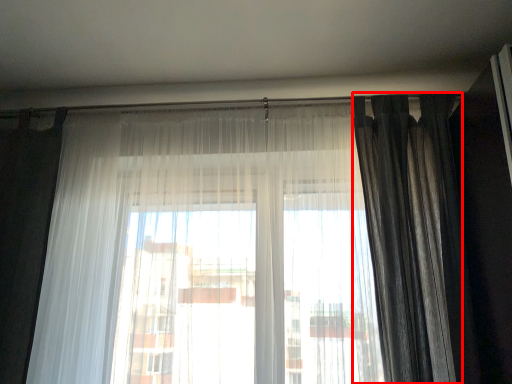
Question: From the image's perspective, what is the correct spatial positioning of curtain (annotated by the red box) in reference to curtain?

Choices:
 (A) below
 (B) above

Answer: (B)